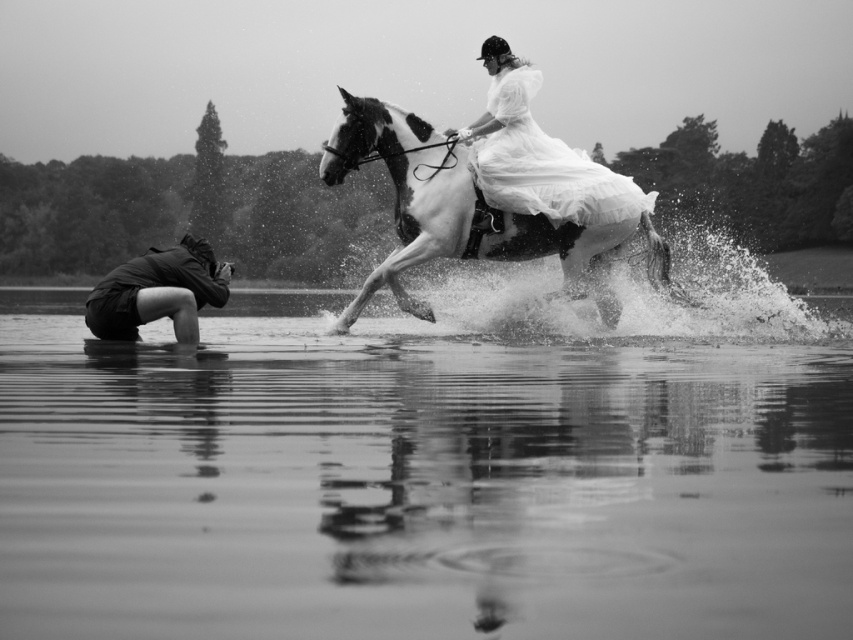
You are a photographer trying to set up your equipment. You have a dark gray fabric camera at lower left and smooth water at lower center in your view. Which object takes up more space in the image?

The smooth water at lower center takes up more space in the image as it is bigger than the dark gray fabric camera at lower left.

You are a photographer trying to capture the rider in the white satin dress at upper center. You are holding the dark gray fabric camera at lower left. Can you see the rider clearly through your camera lens without any obstructions?

The white satin dress at upper center is further to the viewer than the dark gray fabric camera at lower left, so the rider in the white satin dress at upper center is closer to you. This means you can see the rider clearly through your camera lens without any obstructions because the camera is positioned lower and the rider is in front of it.

You are the photographer in the scene. You want to move your dark gray fabric camera at lower left to get a better angle of the white glossy horse at center. In which direction should you move the camera?

You should move the dark gray fabric camera at lower left to the right to align it with the white glossy horse at center, which is positioned to the right of the camera.